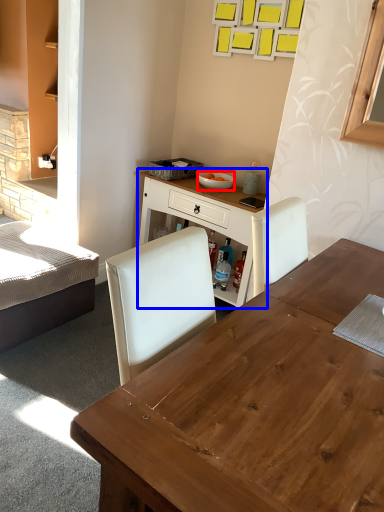
Question: Among these objects, which one is nearest to the camera, bowl (highlighted by a red box) or table (highlighted by a blue box)?

Choices:
 (A) bowl
 (B) table

Answer: (B)